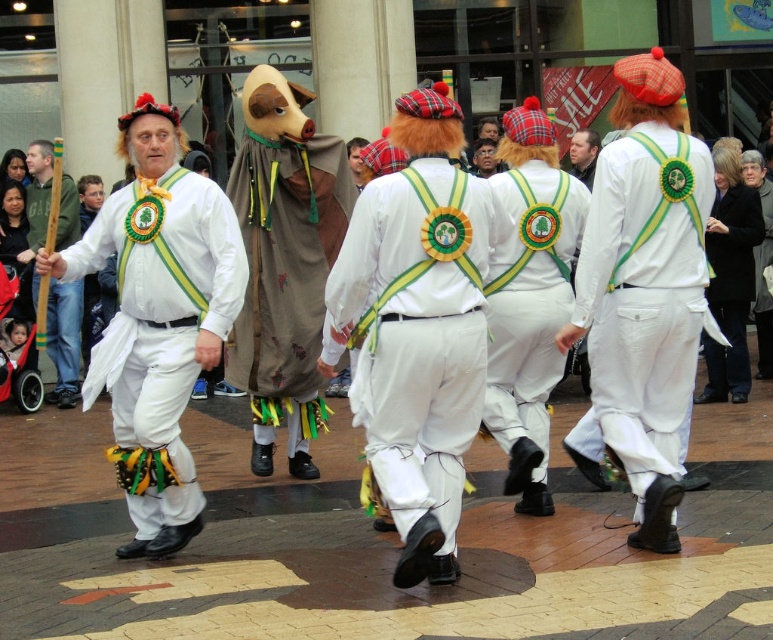
You are a photographer standing at the center of the street. You want to take a photo that includes both the brown fabric mask at center and the black wool coat at right. What is the minimum distance you need to move forward or backward to ensure both objects are in frame?

The brown fabric mask at center and the black wool coat at right are 4.42 meters apart. To include both in the photo, you need to move back until the entire distance between them fits within your camera frame.

You are a photographer trying to capture the performers in the scene. You notice the white matte fabric at center and the white matte pants at center. Which one is located to the left of the other?

The white matte fabric at center is positioned on the left side of white matte pants at center.

You are a photographer standing at the center of the street. You want to take a photo of the brown fabric mask at center. Where should you aim your camera to capture it in the frame?

You should aim your camera at the point with coordinates (285, 275) to capture the brown fabric mask at center in the frame.